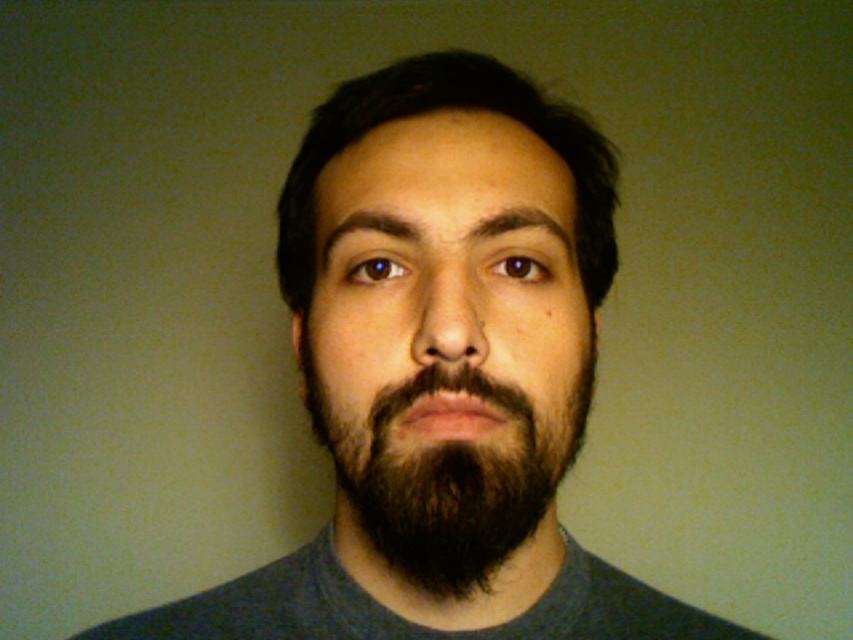
You are an artist sketching this portrait. You need to draw the dark brown fuzzy beard at center and the dark brown hair at center. Which one should you draw first if you want to follow the standard left to right drawing technique?

The dark brown fuzzy beard at center is positioned on the left side of dark brown hair at center, so you should draw the dark brown fuzzy beard at center first to follow the left to right drawing technique.

You are a photographer trying to capture a portrait similar to the one described. You want to ensure that the subject has both the dark brown fuzzy beard at center and dark brown hair at center visible. Based on the description, which of these two features is shorter in height?

The dark brown fuzzy beard at center has a lesser height compared to the dark brown hair at center, so the beard is shorter in height.